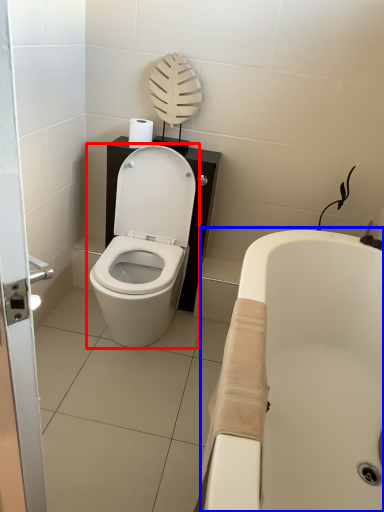
Question: Which point is further to the camera, toilet (highlighted by a red box) or bath (highlighted by a blue box)?

Choices:
 (A) toilet
 (B) bath

Answer: (A)